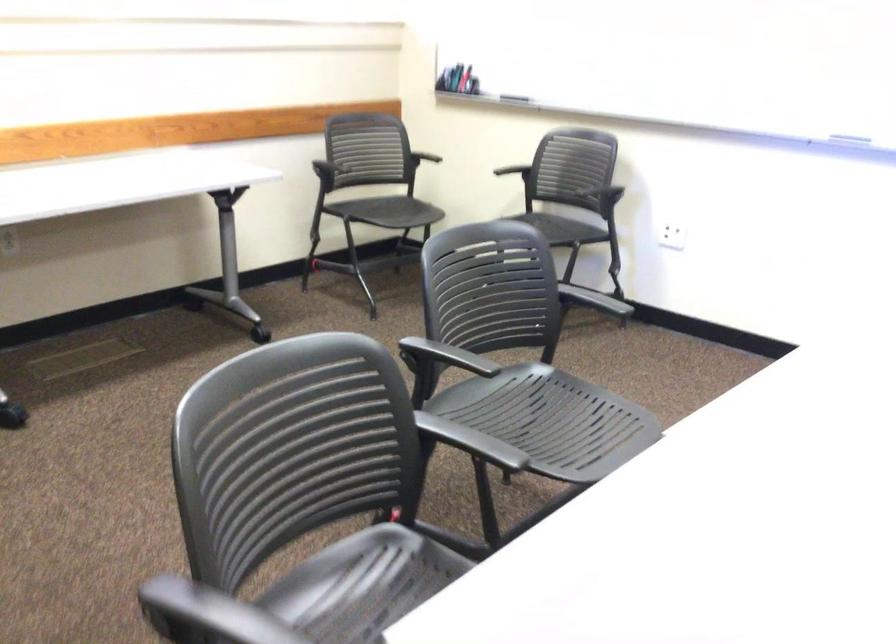
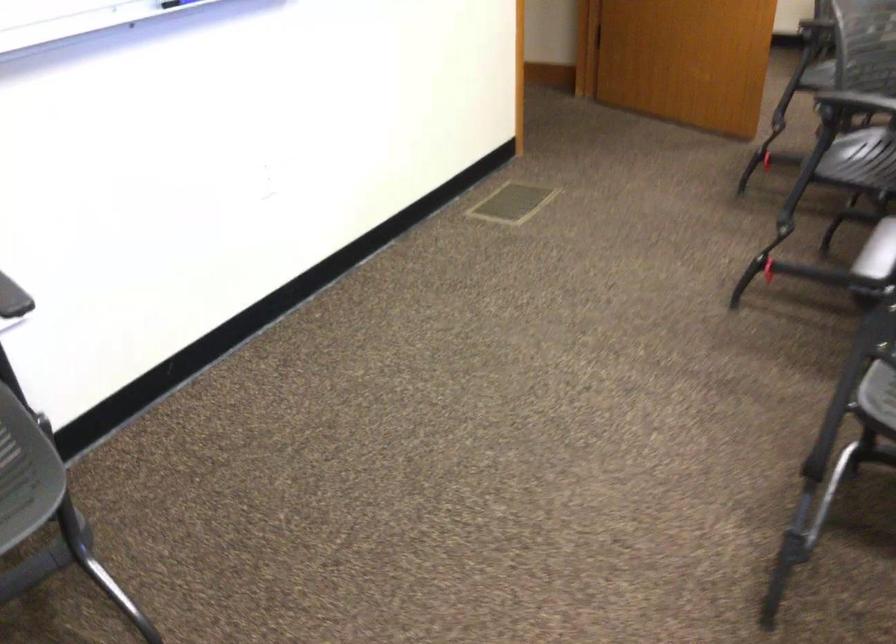
Find the pixel in the second image that matches point 570,308 in the first image.

(876, 252)